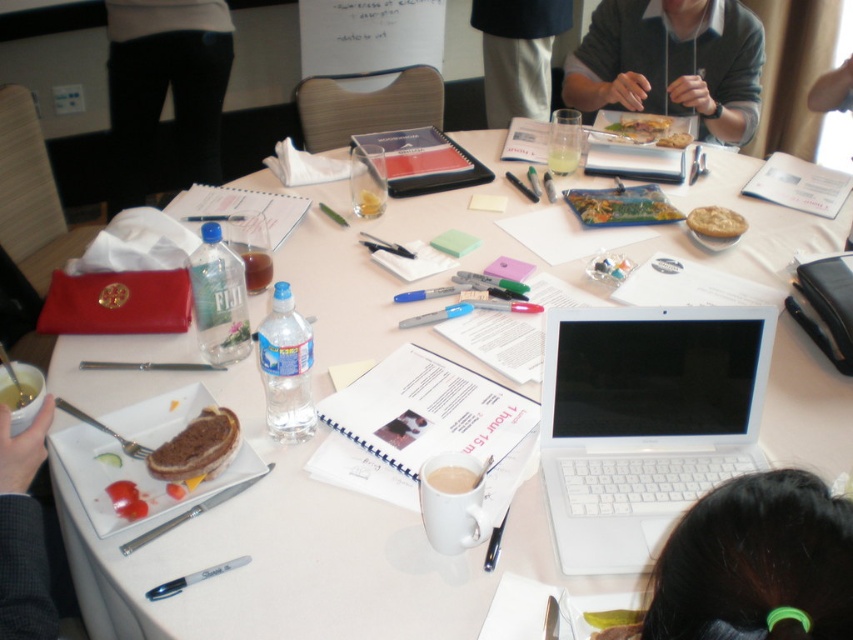
Question: Which of the following is the closest to the observer?

Choices:
 (A) metallic silver fork at lower left
 (B) golden flaky pie at center

Answer: (A)

Question: Is black pants at center closer to the viewer compared to brown toasted bread at center?

Choices:
 (A) no
 (B) yes

Answer: (A)

Question: Can you confirm if white plastic laptop at center is wider than black hair at lower right?

Choices:
 (A) yes
 (B) no

Answer: (A)

Question: Does black pants at center have a greater width compared to metallic silver fork at lower left?

Choices:
 (A) yes
 (B) no

Answer: (A)

Question: Among these objects, which one is nearest to the camera?

Choices:
 (A) white plastic laptop at center
 (B) brown toasted bread at center
 (C) black hair at lower right

Answer: (C)

Question: Which point is closer to the camera?

Choices:
 (A) dark gray sweater at upper right
 (B) gray sweater at upper right
 (C) golden crispy bread at upper center
 (D) golden flaky pie at center

Answer: (D)